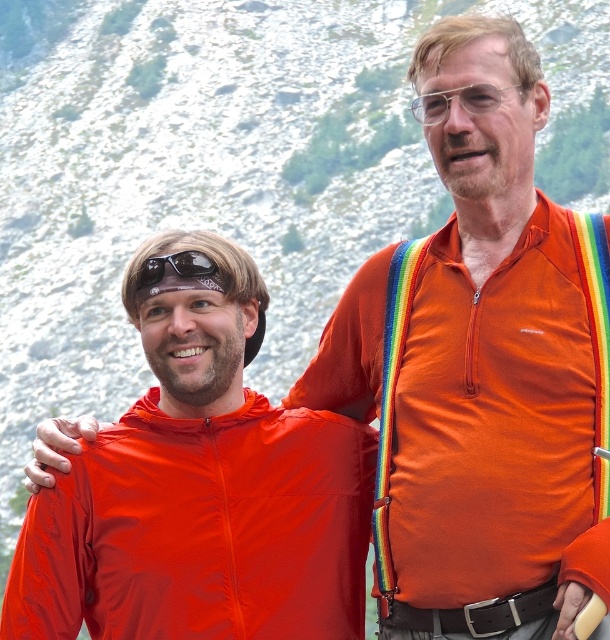
Question: Does orange fabric jacket at center have a greater width compared to black rubber sunglasses at upper left?

Choices:
 (A) yes
 (B) no

Answer: (A)

Question: Which point is farther to the camera?

Choices:
 (A) matte nylon jacket at left
 (B) clear plastic goggles at upper center
 (C) orange fabric jacket at center
 (D) black rubber sunglasses at upper left

Answer: (D)

Question: Is clear plastic goggles at upper center thinner than black rubber sunglasses at upper left?

Choices:
 (A) yes
 (B) no

Answer: (B)

Question: Among these objects, which one is nearest to the camera?

Choices:
 (A) black rubber sunglasses at upper left
 (B) matte nylon jacket at left
 (C) orange fabric jacket at center
 (D) clear plastic goggles at upper center

Answer: (C)

Question: Estimate the real-world distances between objects in this image. Which object is farther from the black rubber sunglasses at upper left?

Choices:
 (A) orange fabric jacket at center
 (B) matte nylon jacket at left
 (C) clear plastic goggles at upper center

Answer: (C)

Question: Does matte nylon jacket at left come behind black rubber sunglasses at upper left?

Choices:
 (A) yes
 (B) no

Answer: (B)